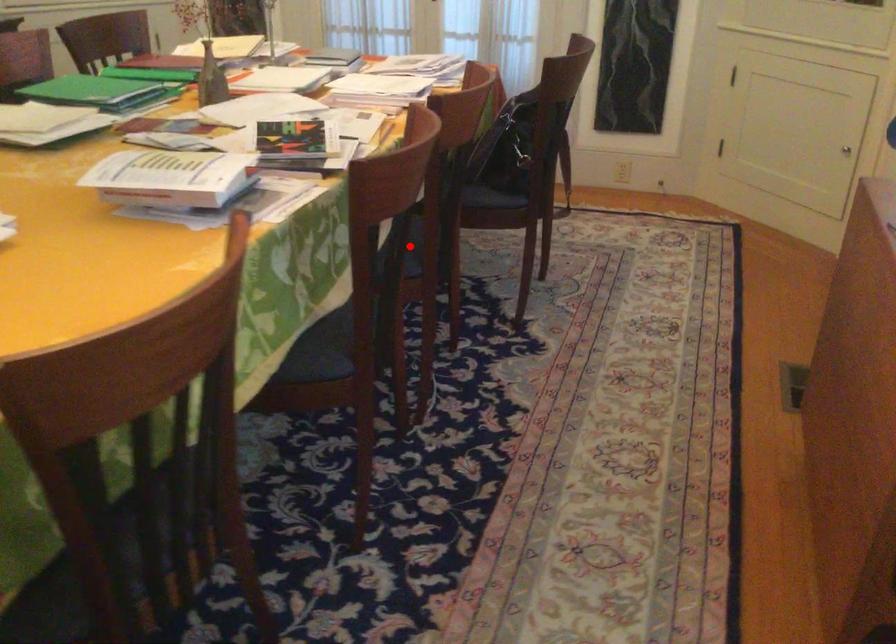
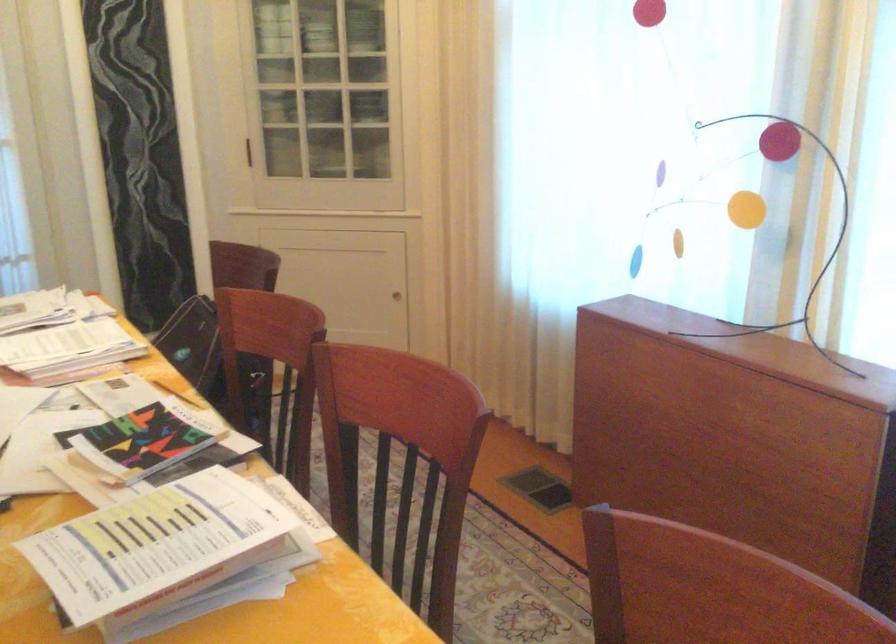
Question: I am providing you with two images of the same scene from different viewpoints. A red point is marked on the first image. Is the red point's position out of view in image 2?

Choices:
 (A) Yes
 (B) No

Answer: (A)